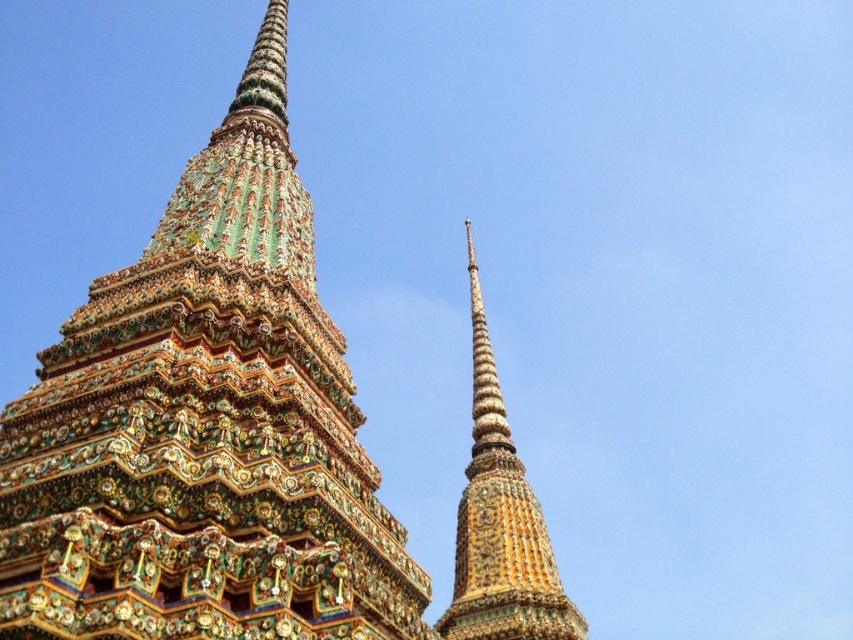
Question: Is multicolored mosaic temple spire at center above gold/gilded stupa at center?

Choices:
 (A) no
 (B) yes

Answer: (B)

Question: Which point is farther to the camera?

Choices:
 (A) gold/gilded stupa at center
 (B) multicolored mosaic temple spire at center

Answer: (A)

Question: Is multicolored mosaic temple spire at center positioned at the back of gold/gilded stupa at center?

Choices:
 (A) yes
 (B) no

Answer: (B)

Question: Which of the following is the closest to the observer?

Choices:
 (A) (289, 337)
 (B) (473, 422)

Answer: (A)

Question: Can you confirm if multicolored mosaic temple spire at center is wider than gold/gilded stupa at center?

Choices:
 (A) no
 (B) yes

Answer: (B)